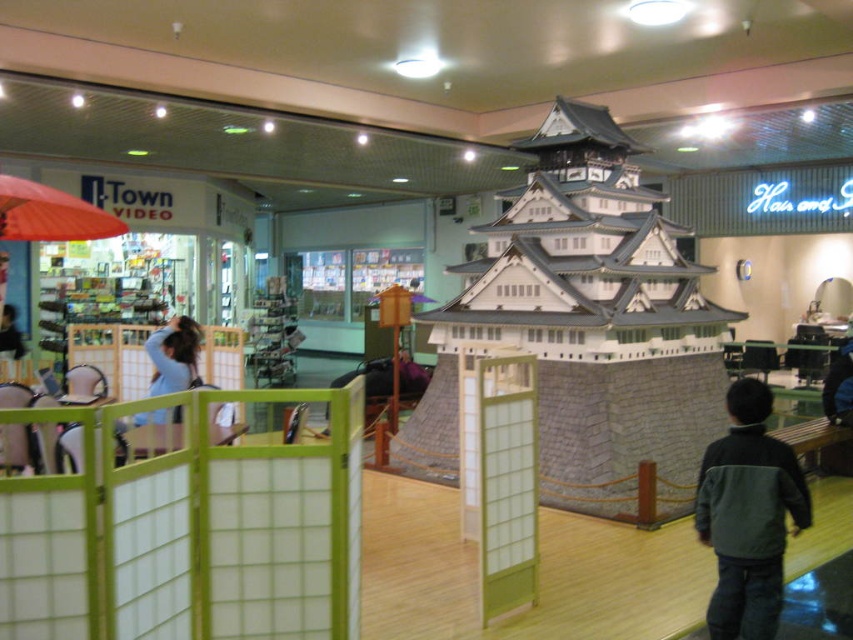
Question: Among these objects, which one is nearest to the camera?

Choices:
 (A) orange fabric umbrella at upper left
 (B) light blue fabric at left
 (C) dark green fleece jacket at lower right

Answer: (C)

Question: Which of the following is the closest to the observer?

Choices:
 (A) (183, 374)
 (B) (753, 451)

Answer: (B)

Question: Can you confirm if orange fabric umbrella at upper left is positioned above light blue fabric at left?

Choices:
 (A) no
 (B) yes

Answer: (B)

Question: Among these points, which one is farthest from the camera?

Choices:
 (A) (9, 205)
 (B) (160, 340)
 (C) (775, 609)

Answer: (B)

Question: Is dark green fleece jacket at lower right in front of orange fabric umbrella at upper left?

Choices:
 (A) yes
 (B) no

Answer: (A)

Question: Is dark green fleece jacket at lower right to the left of light blue fabric at left from the viewer's perspective?

Choices:
 (A) no
 (B) yes

Answer: (A)